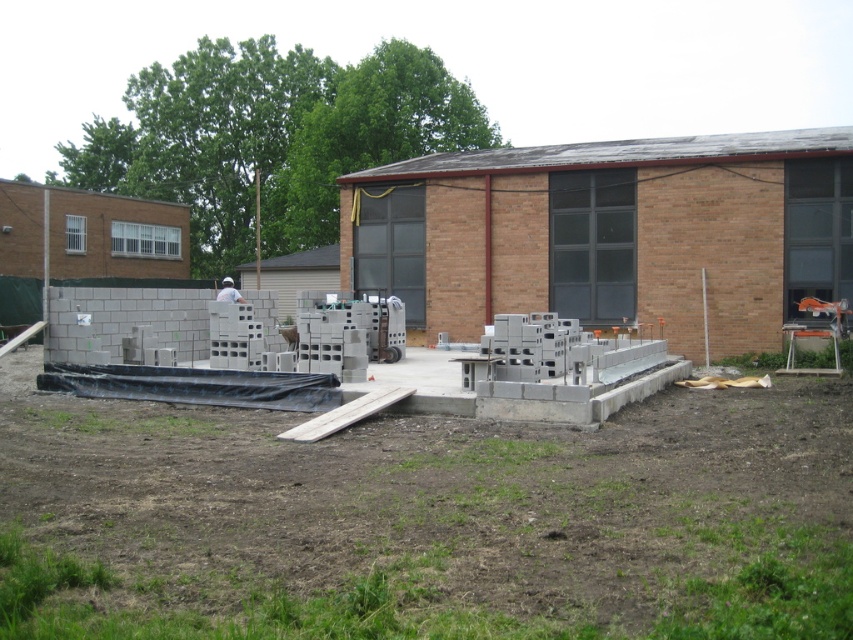
Who is higher up, gray concrete blocks at center or white matte construction worker at center?

white matte construction worker at center is higher up.

Which is behind, point (451, 401) or point (225, 296)?

Positioned behind is point (225, 296).

Locate an element on the screen. gray concrete blocks at center is located at coordinates (376, 364).